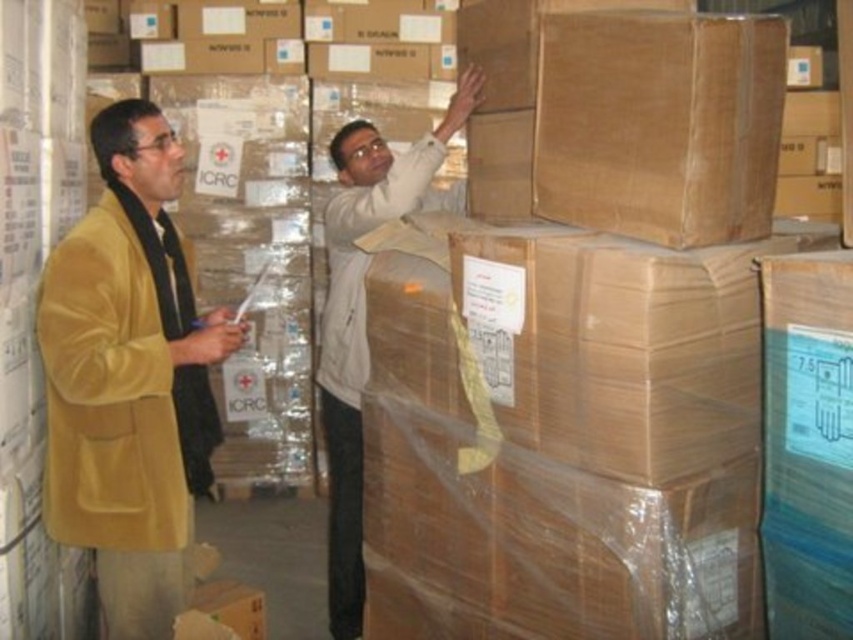
Is velvet gold coat at left thinner than white matte jacket at upper center?

Incorrect, velvet gold coat at left's width is not less than white matte jacket at upper center's.

Is point (123, 428) less distant than point (390, 196)?

Yes, point (123, 428) is in front of point (390, 196).

Locate an element on the screen. This screenshot has height=640, width=853. velvet gold coat at left is located at coordinates (129, 378).

Locate an element on the screen. velvet gold coat at left is located at coordinates 129,378.

Looking at this image, between light beige fabric shirt at upper center and white matte jacket at upper center, which one appears on the left side from the viewer's perspective?

Positioned to the left is light beige fabric shirt at upper center.

Which is behind, point (326, 378) or point (347, 356)?

The point (326, 378) is behind.

You are a GUI agent. You are given a task and a screenshot of the screen. Output one action in this format:
    pyautogui.click(x=<x>, y=<y>)
    Task: Click on the light beige fabric shirt at upper center
    The height and width of the screenshot is (640, 853).
    Given the screenshot: What is the action you would take?
    pyautogui.click(x=363, y=320)

Between point (67, 524) and point (392, 211), which one is positioned in front?

Point (67, 524) is more forward.

Can you confirm if velvet gold coat at left is shorter than light beige fabric shirt at upper center?

Yes, velvet gold coat at left is shorter than light beige fabric shirt at upper center.

Image resolution: width=853 pixels, height=640 pixels. Describe the element at coordinates (129, 378) in the screenshot. I see `velvet gold coat at left` at that location.

Find the location of `velvet gold coat at left`. velvet gold coat at left is located at coordinates click(129, 378).